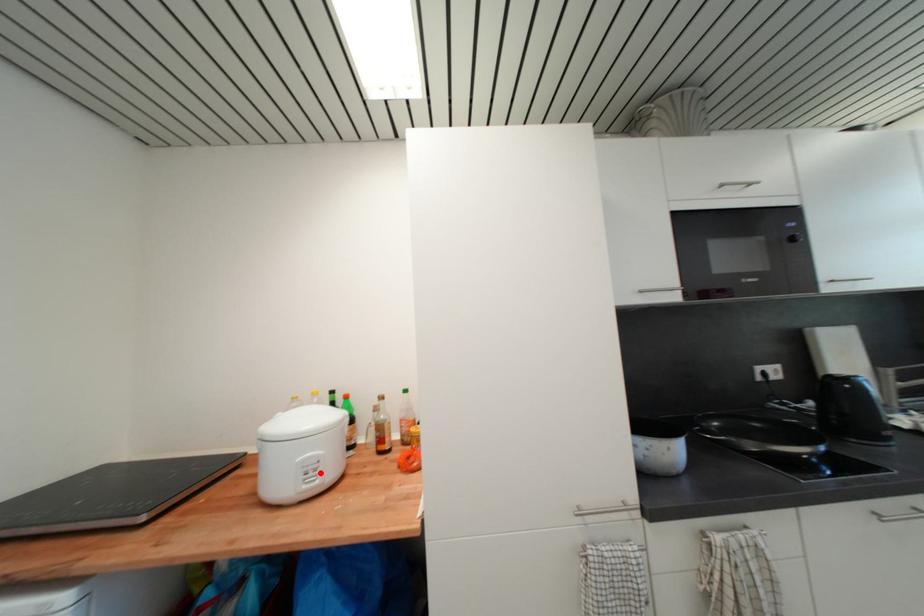
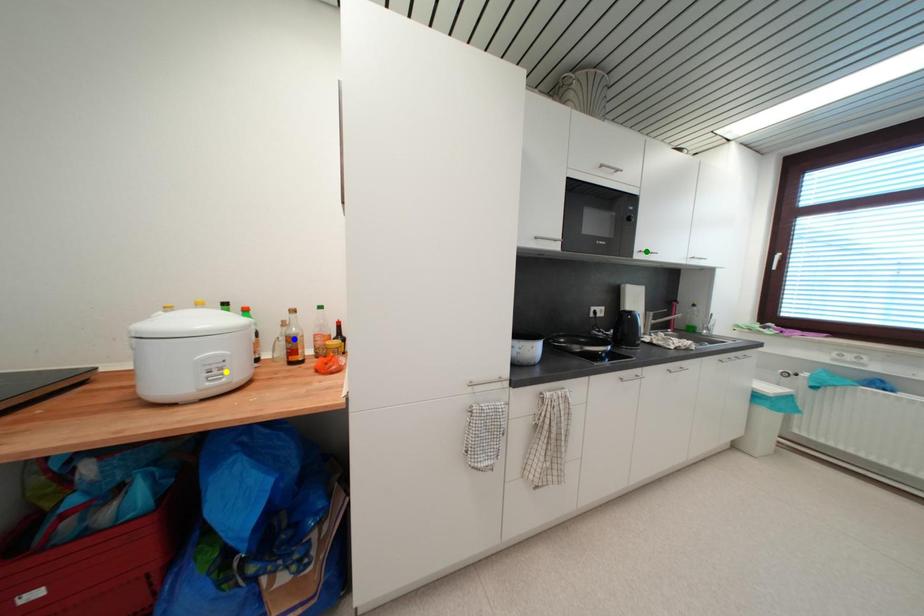
Question: I am providing you with two images of the same scene from different viewpoints. A red point is marked on the first image. You are given multiple points on the second image. Which mark in image 2 goes with the point in image 1?

Choices:
 (A) yellow point
 (B) blue point
 (C) green point

Answer: (A)